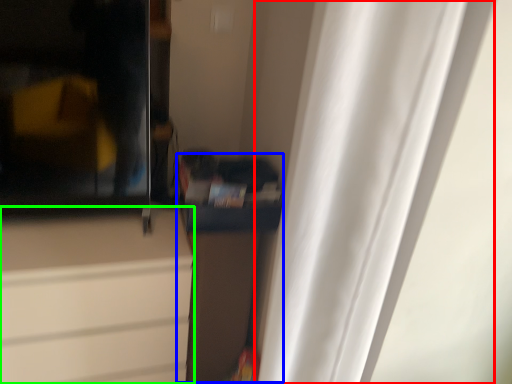
Question: Which is nearer to the curtain (highlighted by a red box)? cabinetry (highlighted by a blue box) or cabinetry (highlighted by a green box).

Choices:
 (A) cabinetry
 (B) cabinetry

Answer: (A)